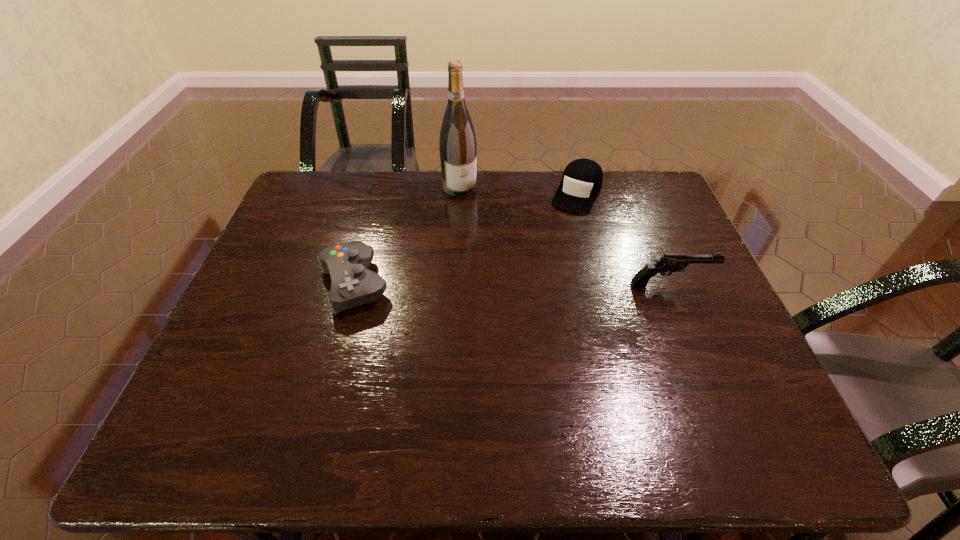
Locate an element on the screen. Image resolution: width=960 pixels, height=540 pixels. object that stands as the closest to the gun is located at coordinates (582, 179).

Locate which object is the second closest to the gun. Please provide its 2D coordinates. Your answer should be formatted as a tuple, i.e. [(x, y)], where the tuple contains the x and y coordinates of a point satisfying the conditions above.

[(458, 148)]

Identify the location of free region that satisfies the following two spatial constraints: 1. on the front side of the tallest object; 2. at the end of the barrel of the gun. (454, 284).

Find the location of a particular element. This screenshot has width=960, height=540. free spot that satisfies the following two spatial constraints: 1. on the back side of the gun; 2. at the end of the barrel of the leftmost object is located at coordinates (354, 284).

Find the location of `free location that satisfies the following two spatial constraints: 1. on the front side of the tallest object; 2. on the left side of the cap`. free location that satisfies the following two spatial constraints: 1. on the front side of the tallest object; 2. on the left side of the cap is located at coordinates (460, 194).

Where is `vacant space that satisfies the following two spatial constraints: 1. on the front side of the cap; 2. at the end of the barrel of the gun`? The image size is (960, 540). vacant space that satisfies the following two spatial constraints: 1. on the front side of the cap; 2. at the end of the barrel of the gun is located at coordinates (600, 284).

Find the location of a particular element. free spot that satisfies the following two spatial constraints: 1. on the front side of the gun; 2. at the end of the barrel of the tallest object is located at coordinates (454, 284).

Identify the location of vacant position in the image that satisfies the following two spatial constraints: 1. on the back side of the gun; 2. at the end of the barrel of the control. (354, 284).

I want to click on vacant area that satisfies the following two spatial constraints: 1. on the front side of the gun; 2. at the end of the barrel of the cap, so click(x=600, y=284).